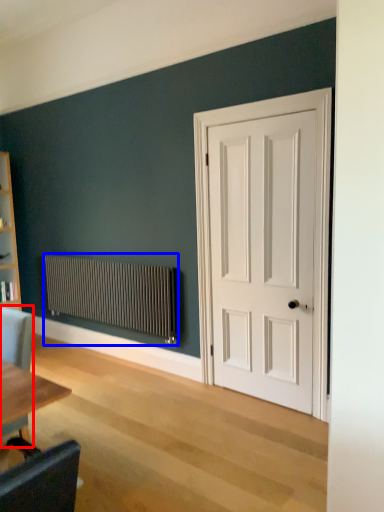
Question: Which of the following is the closest to the observer, chair (highlighted by a red box) or radiator (highlighted by a blue box)?

Choices:
 (A) chair
 (B) radiator

Answer: (A)